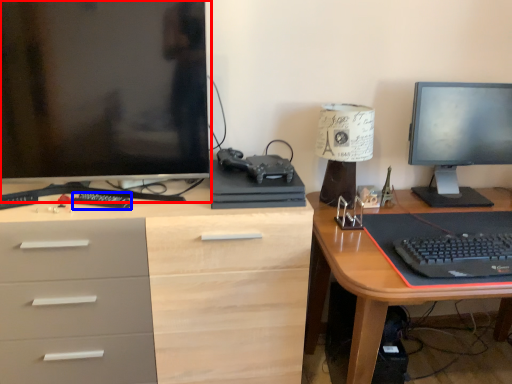
Question: Which point is further to the camera, computer monitor (highlighted by a red box) or remote control (highlighted by a blue box)?

Choices:
 (A) computer monitor
 (B) remote control

Answer: (B)